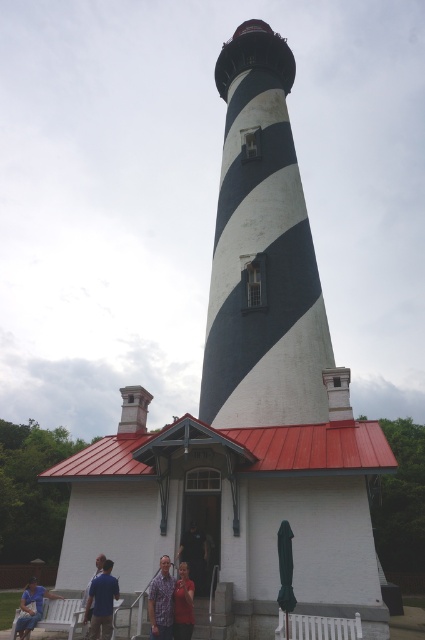
Can you confirm if white painted wood park bench at lower center is bigger than light brown wood shirt at center?

Correct, white painted wood park bench at lower center is larger in size than light brown wood shirt at center.

Does white painted wood park bench at lower center come behind light brown wood shirt at center?

No, it is not.

Which is in front, point (278, 632) or point (186, 632)?

Point (278, 632)

Where is `white painted wood park bench at lower center`? The image size is (425, 640). white painted wood park bench at lower center is located at coordinates (317, 627).

Is light brown wood shirt at center wider than blue denim jeans at lower left?

Incorrect, light brown wood shirt at center's width does not surpass blue denim jeans at lower left's.

Is light brown wood shirt at center further to camera compared to blue denim jeans at lower left?

No, it is not.

Image resolution: width=425 pixels, height=640 pixels. I want to click on light brown wood shirt at center, so click(183, 604).

Which is below, white painted wood park bench at lower center or printed cotton shirt at lower center?

white painted wood park bench at lower center is below.

How far apart are white painted wood park bench at lower center and printed cotton shirt at lower center?

white painted wood park bench at lower center and printed cotton shirt at lower center are 8.68 feet apart from each other.

Identify the location of white painted wood park bench at lower center. (317, 627).

I want to click on white painted wood park bench at lower center, so click(317, 627).